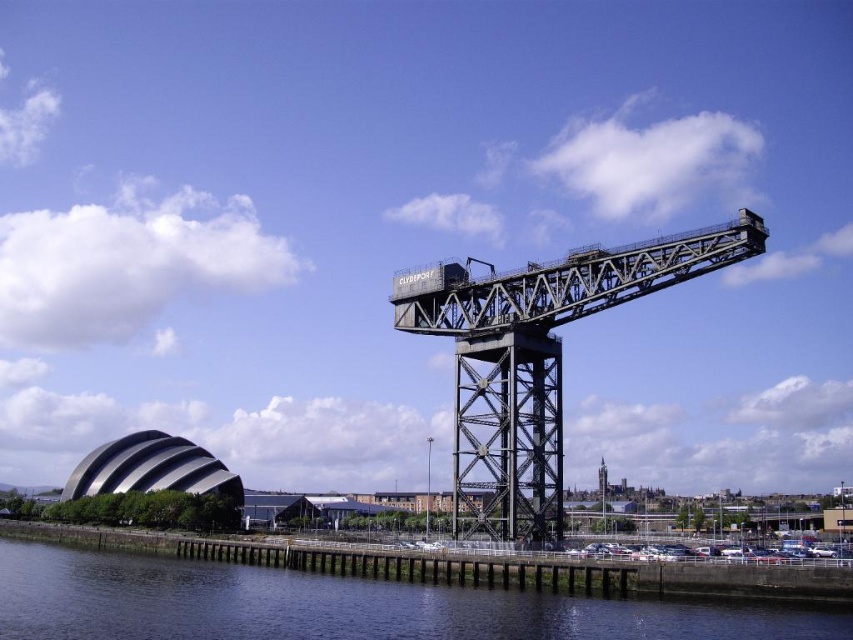
Is point (654, 621) farther from camera compared to point (589, 262)?

No, it is not.

Does dark blue water at lower center appear under black steel crane at center?

Yes, dark blue water at lower center is below black steel crane at center.

Where is `dark blue water at lower center`? dark blue water at lower center is located at coordinates (335, 605).